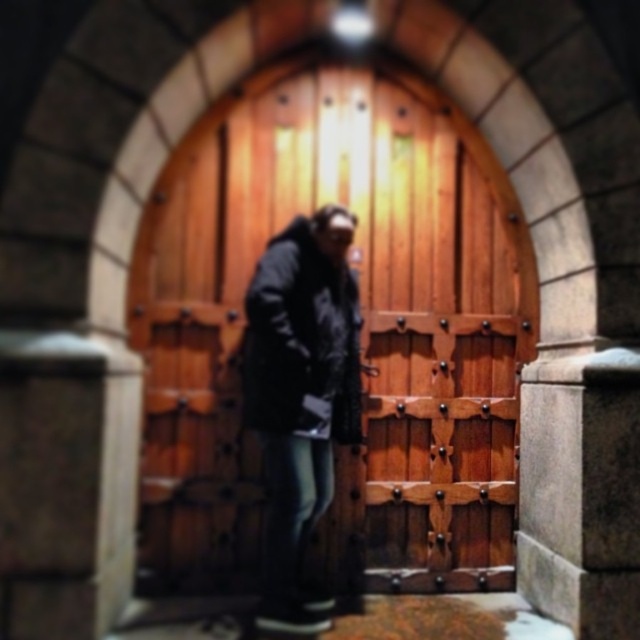
Consider the image. You are an interior designer assessing the space in front of the wooden at center and dark gray fabric jacket at center. Which object is wider?

The wooden at center is wider than the dark gray fabric jacket at center.

You are standing in front of a large wooden door framed by an arched stone structure. There is a point at coordinates point (168, 522). Can you estimate how far this point is from you?

The point (168, 522) is 12.15 feet away from the viewer.

You are an architect designing a new building and want to ensure the door and the person standing in front of it are proportionate. Based on the scene, which object is taller between the wooden at center and the dark gray fabric jacket at center?

The wooden at center is taller than the dark gray fabric jacket at center according to the description.